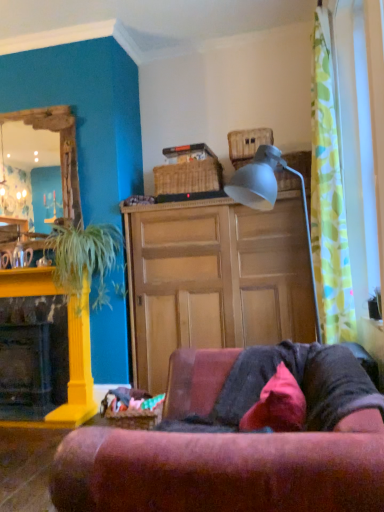
Locate an element on the screen. free space above multicolored woven picnic basket at lower center, positioned as the 1th picnic basket in bottom-to-top order (from a real-world perspective) is located at coordinates (125, 403).